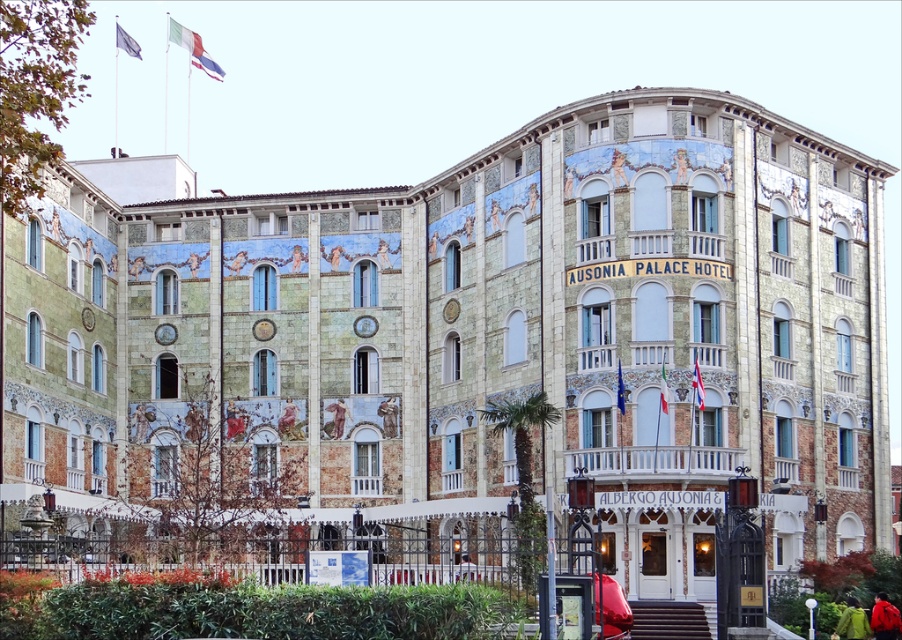
You are a hotel guest who just arrived and is standing in front of the Ausonia Palace Hotel. You notice two jackets near the entrance. Which jacket is bigger between the green matte jacket at lower right and the red jacket at lower center?

The green matte jacket at lower right is larger in size than the red jacket at lower center.

You are a guest at the Ausonia Palace Hotel and want to place your red jacket at lower center on the brown textured fabric at center. Will the fabric be able to fully cover the jacket?

The brown textured fabric at center has a larger width than the red jacket at lower center, so it can fully cover the jacket.